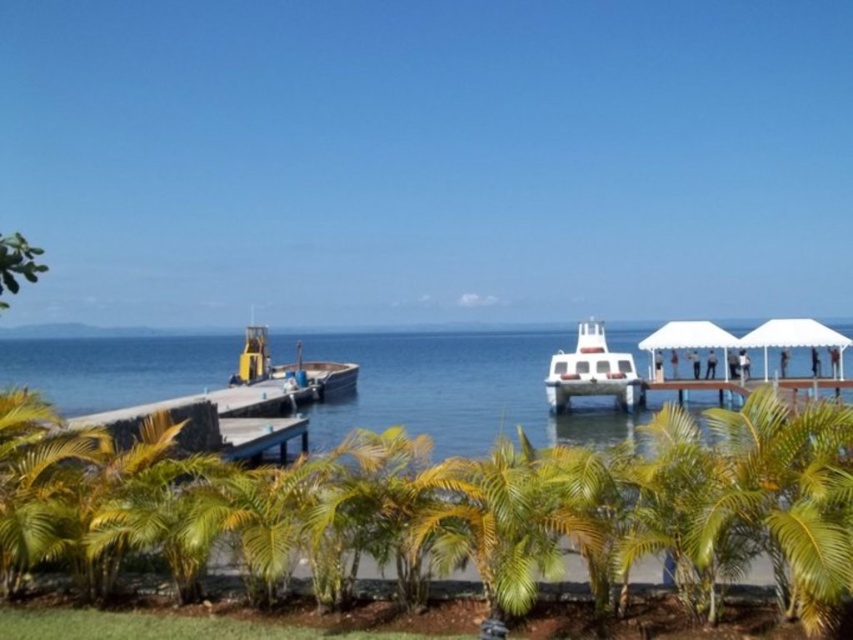
Who is more distant from viewer, (166,401) or (605,376)?

The point (166,401) is more distant.

Is point (273, 390) behind point (621, 368)?

Yes, point (273, 390) is farther from viewer.

This screenshot has height=640, width=853. Identify the location of smooth concrete dock at left. pyautogui.click(x=215, y=420).

Does smooth concrete dock at left have a greater width compared to white wooden dock at lower right?

Indeed, smooth concrete dock at left has a greater width compared to white wooden dock at lower right.

Is smooth concrete dock at left closer to the viewer compared to white wooden dock at lower right?

Yes, smooth concrete dock at left is in front of white wooden dock at lower right.

Does point (178, 412) come closer to viewer compared to point (780, 387)?

Yes, it is.

Image resolution: width=853 pixels, height=640 pixels. Identify the location of smooth concrete dock at left. [x=215, y=420].

Can you confirm if smooth concrete dock at left is taller than yellow matte boat at lower left?

Correct, smooth concrete dock at left is much taller as yellow matte boat at lower left.

Which is in front, point (91, 420) or point (343, 365)?

Point (91, 420) is in front.

Who is more distant from viewer, [132,424] or [329,385]?

Positioned behind is point [329,385].

The height and width of the screenshot is (640, 853). Find the location of `smooth concrete dock at left`. smooth concrete dock at left is located at coordinates (215, 420).